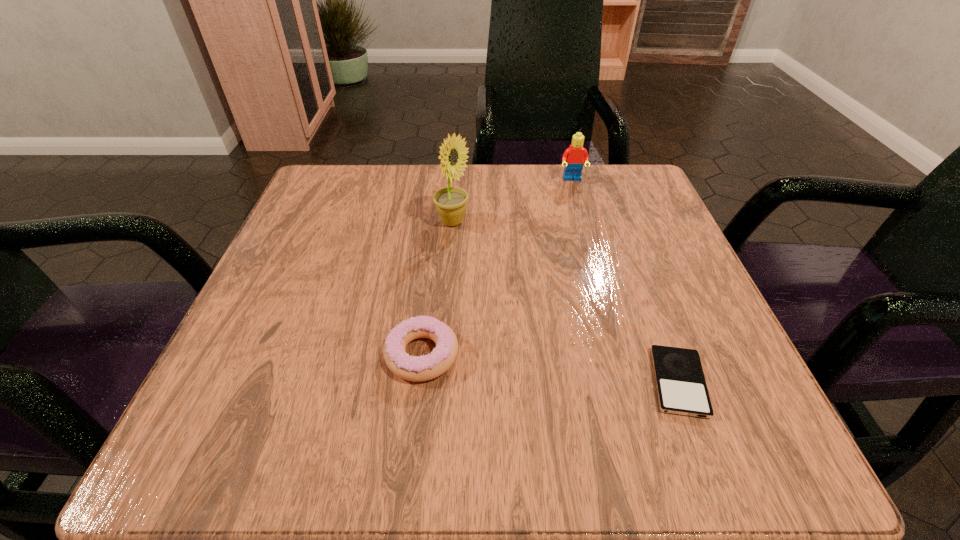
This screenshot has height=540, width=960. What are the coordinates of `sunflower that is at the far edge` in the screenshot? It's located at 451,202.

You are a GUI agent. You are given a task and a screenshot of the screen. Output one action in this format:
    pyautogui.click(x=<x>, y=<y>)
    Task: Click on the Lego positioned at the far edge
    
    Given the screenshot: What is the action you would take?
    (x=574, y=156)

This screenshot has height=540, width=960. Identify the location of object present at the near edge. click(x=681, y=388).

This screenshot has height=540, width=960. Identify the location of Lego located in the right edge section of the desktop. click(x=574, y=156).

Find the location of a particular element. The width and height of the screenshot is (960, 540). iPod that is at the right edge is located at coordinates (681, 388).

Find the location of a particular element. This screenshot has width=960, height=540. object located in the far right corner section of the desktop is located at coordinates (574, 156).

This screenshot has height=540, width=960. In order to click on object at the near right corner in this screenshot , I will do `click(681, 388)`.

Find the location of `vacant space at the far edge of the desktop`. vacant space at the far edge of the desktop is located at coordinates (534, 169).

Find the location of a particular element. The width and height of the screenshot is (960, 540). free space at the right edge of the desktop is located at coordinates (637, 287).

You are a GUI agent. You are given a task and a screenshot of the screen. Output one action in this format:
    pyautogui.click(x=<x>, y=<y>)
    Task: Click on the vacant space at the far left corner of the desktop
    Image resolution: width=960 pixels, height=540 pixels.
    Given the screenshot: What is the action you would take?
    pyautogui.click(x=342, y=186)